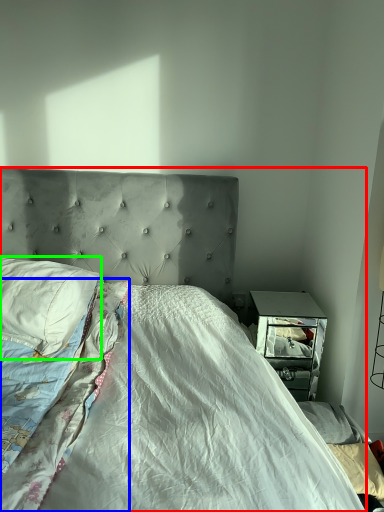
Question: Which object is the farthest from bed (highlighted by a red box)? Choose among these: blanket (highlighted by a blue box) or pillow (highlighted by a green box).

Choices:
 (A) blanket
 (B) pillow

Answer: (B)